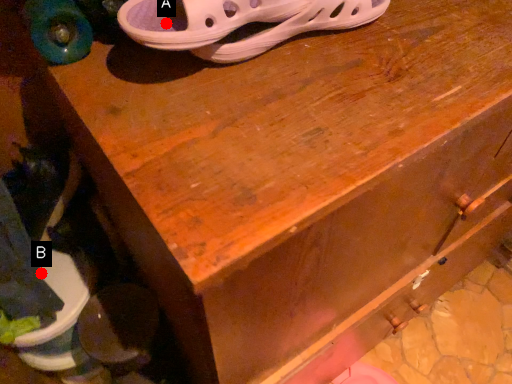
Question: Two points are circled on the image, labeled by A and B beside each circle. Which point is further to the camera?

Choices:
 (A) A is further
 (B) B is further

Answer: (B)